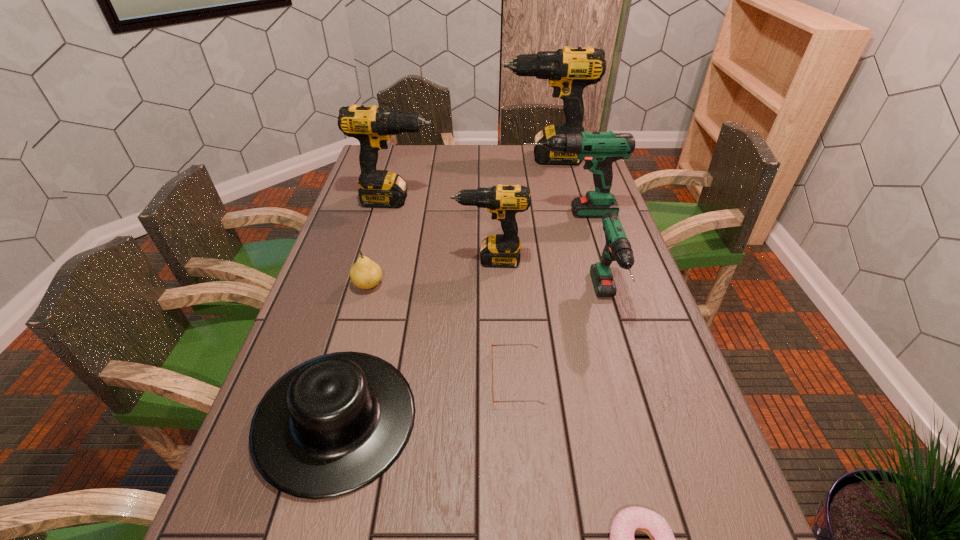
This screenshot has width=960, height=540. In order to click on the farthest drill in this screenshot , I will do `click(569, 70)`.

You are a GUI agent. You are given a task and a screenshot of the screen. Output one action in this format:
    pyautogui.click(x=<x>, y=<y>)
    Task: Click on the tallest object
    
    Given the screenshot: What is the action you would take?
    pyautogui.click(x=569, y=70)

Locate an element on the screen. Image resolution: width=960 pixels, height=540 pixels. the leftmost black drill is located at coordinates (372, 126).

This screenshot has height=540, width=960. Identify the location of the second nearest black drill. (372, 126).

Find the location of a particular element. The width and height of the screenshot is (960, 540). the bigger green drill is located at coordinates (599, 150).

This screenshot has height=540, width=960. Find the location of `the fourth farthest object`. the fourth farthest object is located at coordinates (501, 250).

You are a GUI agent. You are given a task and a screenshot of the screen. Output one action in this format:
    pyautogui.click(x=<x>, y=<y>)
    Task: Click on the second nearest drill
    This screenshot has height=540, width=960.
    Given the screenshot: What is the action you would take?
    pyautogui.click(x=501, y=250)

Where is `the shortest drill`? the shortest drill is located at coordinates (618, 248).

This screenshot has height=540, width=960. I want to click on the nearer green drill, so click(618, 248).

Where is `black dress hat`? This screenshot has height=540, width=960. black dress hat is located at coordinates (332, 425).